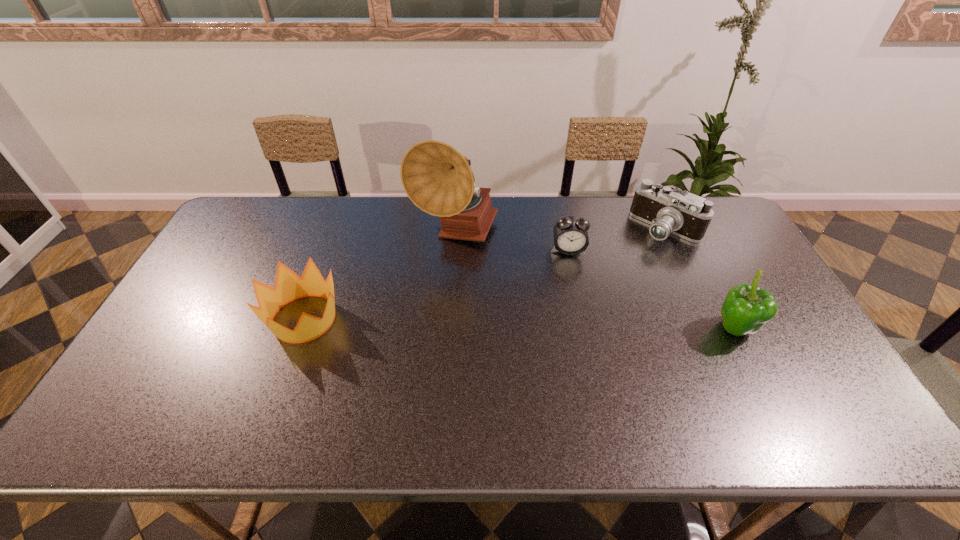
You are a GUI agent. You are given a task and a screenshot of the screen. Output one action in this format:
    pyautogui.click(x=<x>, y=<y>)
    Task: Click on the vacant space on the desktop that is between the crown and the fourth shortest object and is positioned on the horn of the second object from left to right
    The image size is (960, 540).
    Given the screenshot: What is the action you would take?
    pyautogui.click(x=477, y=323)

Find the location of a particular element. vacant space on the desktop that is between the crown and the bell pepper and is positioned on the front side of the alarm clock is located at coordinates (579, 326).

Find the location of a particular element. vacant space on the desktop that is between the crown and the fourth shortest object and is positioned at the lens of the camera is located at coordinates (539, 325).